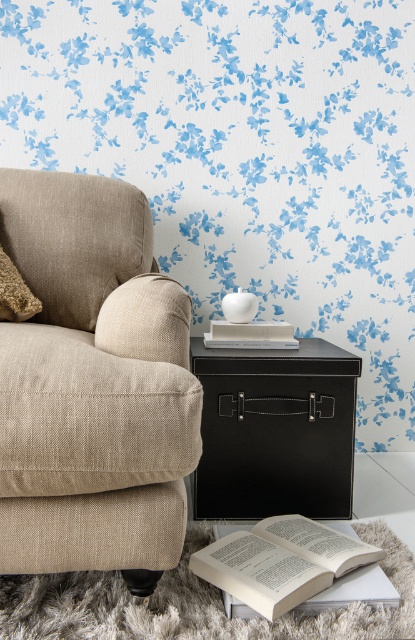
The width and height of the screenshot is (415, 640). Describe the element at coordinates (288, 564) in the screenshot. I see `white paper book at lower center` at that location.

Looking at this image, is white paper book at lower center smaller than fuzzy beige pillow at left?

Actually, white paper book at lower center might be larger than fuzzy beige pillow at left.

Which is behind, point (331, 532) or point (4, 275)?

Point (4, 275)

Where is `white paper book at lower center`? white paper book at lower center is located at coordinates (288, 564).

Is the position of beige fabric couch at left less distant than that of fuzzy beige pillow at left?

Yes, beige fabric couch at left is closer to the viewer.

Is beige fabric couch at left wider than fuzzy beige pillow at left?

Indeed, beige fabric couch at left has a greater width compared to fuzzy beige pillow at left.

Is point (99, 524) more distant than point (14, 269)?

That is False.

I want to click on beige fabric couch at left, so click(92, 385).

Who is positioned more to the right, beige fabric couch at left or black leather side table at center?

black leather side table at center is more to the right.

Is point (26, 460) positioned after point (288, 358)?

No.

Which is behind, point (77, 422) or point (232, 396)?

The point (232, 396) is more distant.

The image size is (415, 640). Find the location of `beige fabric couch at left`. beige fabric couch at left is located at coordinates (92, 385).